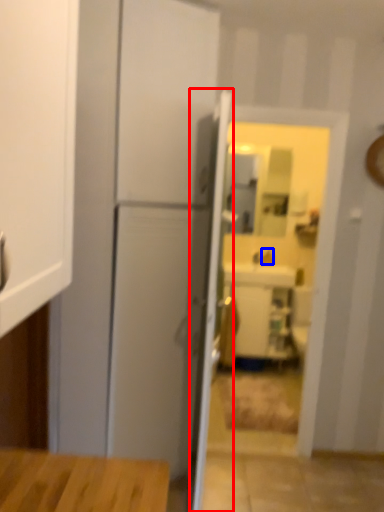
Question: Which point is closer to the camera, door (highlighted by a red box) or faucet (highlighted by a blue box)?

Choices:
 (A) door
 (B) faucet

Answer: (A)